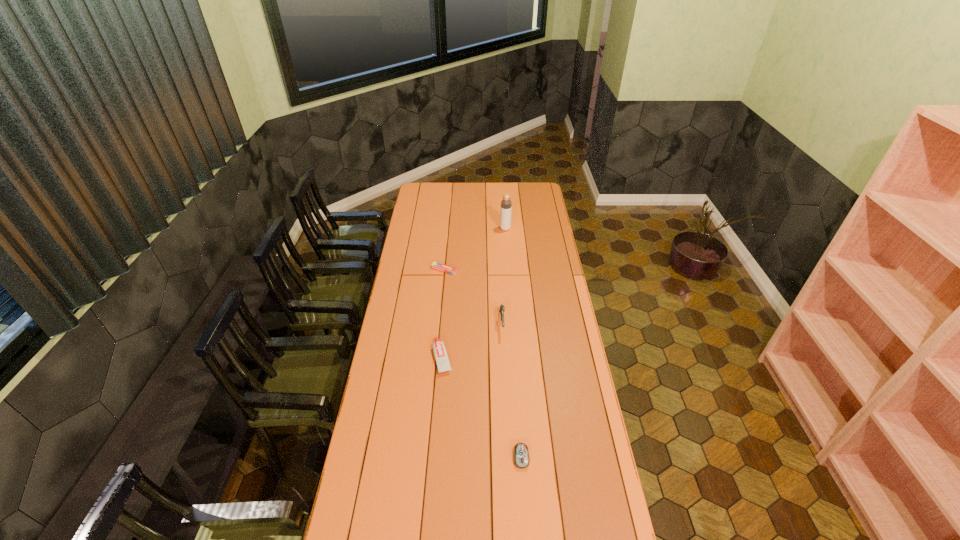
At what (x,y) coordinates should I click in order to perform the action: click on the tallest object. Please return your answer as a coordinate pair (x, y). The image size is (960, 540). Looking at the image, I should click on (506, 205).

The height and width of the screenshot is (540, 960). What are the coordinates of `the farthest object` in the screenshot? It's located at (506, 205).

In order to click on the third object from left to right in this screenshot , I will do `click(502, 309)`.

You are a GUI agent. You are given a task and a screenshot of the screen. Output one action in this format:
    pyautogui.click(x=<x>, y=<y>)
    Task: Click on the third nearest object
    The image size is (960, 540).
    Given the screenshot: What is the action you would take?
    [502, 309]

Where is `the fourth farthest object`? Image resolution: width=960 pixels, height=540 pixels. the fourth farthest object is located at coordinates (440, 353).

You are a GUI agent. You are given a task and a screenshot of the screen. Output one action in this format:
    pyautogui.click(x=<x>, y=<y>)
    Task: Click on the nearer toothpaste
    
    Given the screenshot: What is the action you would take?
    pyautogui.click(x=440, y=353)

Locate an element on the screen. the nearest object is located at coordinates (521, 454).

In order to click on the farther toothpaste in this screenshot , I will do `click(435, 265)`.

You are a GUI agent. You are given a task and a screenshot of the screen. Output one action in this format:
    pyautogui.click(x=<x>, y=<y>)
    Task: Click on the shorter toothpaste
    Image resolution: width=960 pixels, height=540 pixels.
    Given the screenshot: What is the action you would take?
    pyautogui.click(x=435, y=265)

You are a GUI agent. You are given a task and a screenshot of the screen. Output one action in this format:
    pyautogui.click(x=<x>, y=<y>)
    Task: Click on the free space located 0.360m on the front of the tallest object
    The height and width of the screenshot is (540, 960).
    Given the screenshot: What is the action you would take?
    pyautogui.click(x=509, y=272)